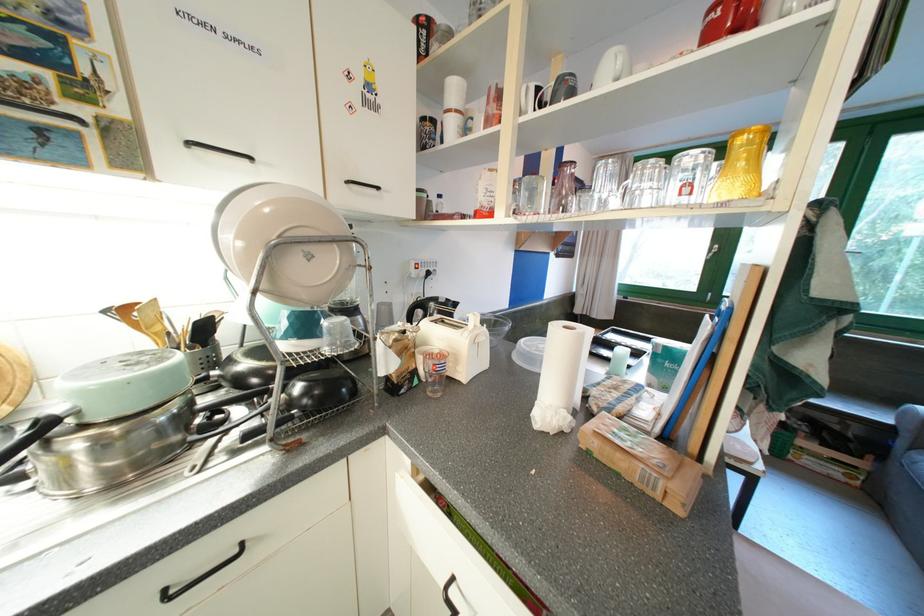
Find the location of a particular element. This screenshot has height=616, width=924. pot lid handle is located at coordinates (35, 431).